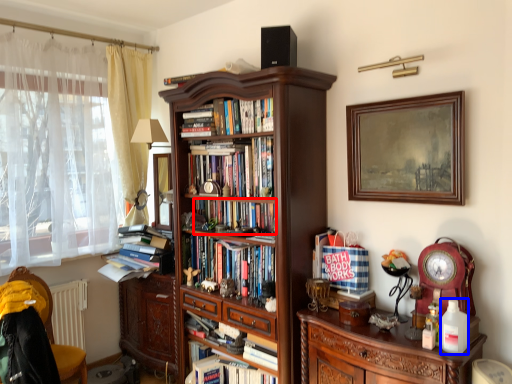
Question: Among these objects, which one is farthest to the camera, book (highlighted by a red box) or bottle (highlighted by a blue box)?

Choices:
 (A) book
 (B) bottle

Answer: (A)